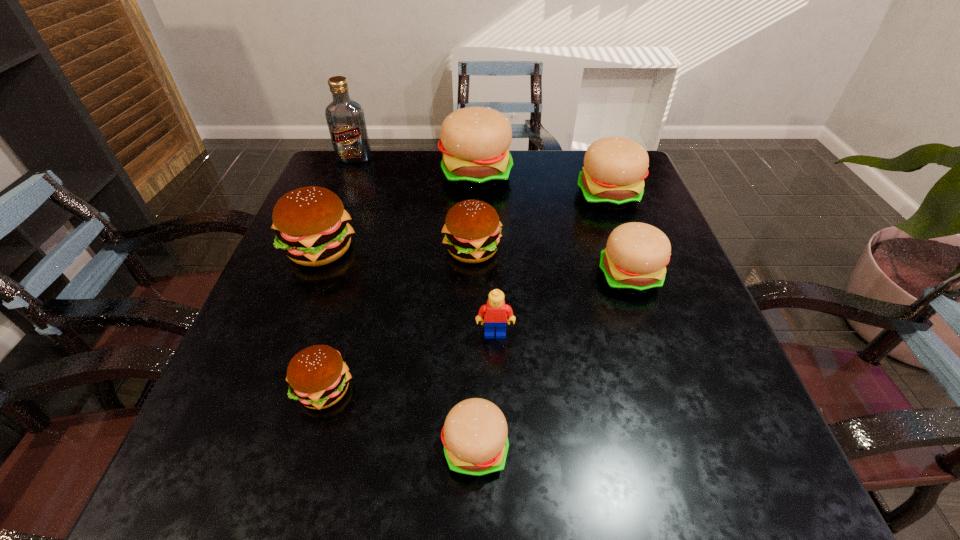
The width and height of the screenshot is (960, 540). I want to click on the nearest object, so click(474, 435).

Image resolution: width=960 pixels, height=540 pixels. In order to click on free point located 0.330m on the front-facing side of the vodka in this screenshot , I will do `click(323, 240)`.

Where is `vacant space located 0.200m on the front of the biggest beige hamburger`? The image size is (960, 540). vacant space located 0.200m on the front of the biggest beige hamburger is located at coordinates (475, 246).

The image size is (960, 540). In order to click on free location located 0.070m on the right of the biggest brown hamburger in this screenshot , I will do `click(388, 249)`.

I want to click on vacant space situated 0.170m on the front of the second biggest beige hamburger, so click(x=632, y=261).

The image size is (960, 540). What are the coordinates of `free space located on the left of the second smallest brown hamburger` in the screenshot? It's located at (358, 250).

Locate an element on the screen. The height and width of the screenshot is (540, 960). blank space located on the left of the second nearest beige hamburger is located at coordinates (560, 276).

Locate an element on the screen. The image size is (960, 540). free spot located on the face of the Lego is located at coordinates (496, 387).

The width and height of the screenshot is (960, 540). I want to click on vacant space situated 0.290m on the right of the nearest brown hamburger, so click(527, 389).

Where is `vacant region located 0.180m on the back of the smallest beige hamburger`? The height and width of the screenshot is (540, 960). vacant region located 0.180m on the back of the smallest beige hamburger is located at coordinates (476, 330).